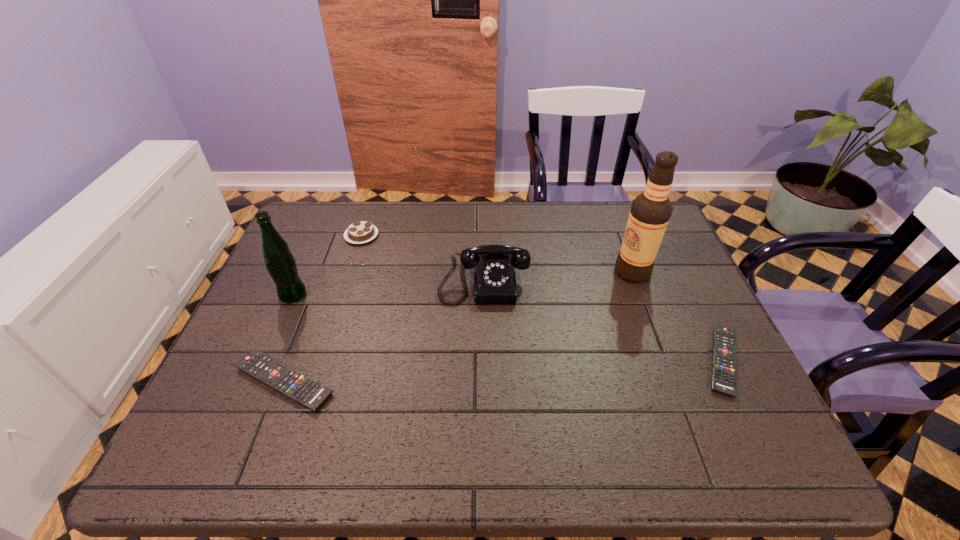
The height and width of the screenshot is (540, 960). Find the location of `the second shortest object`. the second shortest object is located at coordinates (306, 391).

Locate an element on the screen. This screenshot has width=960, height=540. the taller remote control is located at coordinates (306, 391).

Locate an element on the screen. the rightmost object is located at coordinates (724, 343).

You are a GUI agent. You are given a task and a screenshot of the screen. Output one action in this format:
    pyautogui.click(x=<x>, y=<y>)
    Task: Click on the right remote control
    This screenshot has width=960, height=540.
    Given the screenshot: What is the action you would take?
    pyautogui.click(x=724, y=343)

Find the location of a particular element. This screenshot has height=540, width=960. the third tallest object is located at coordinates (494, 281).

Find the location of a particular element. telephone is located at coordinates (494, 281).

Locate an element on the screen. the third shortest object is located at coordinates (358, 232).

This screenshot has height=540, width=960. What are the coordinates of `the farthest object` in the screenshot? It's located at (358, 232).

Locate an element on the screen. beer bottle is located at coordinates click(x=281, y=265).

Identify the location of the fifth object from left to right. This screenshot has height=540, width=960. (650, 212).